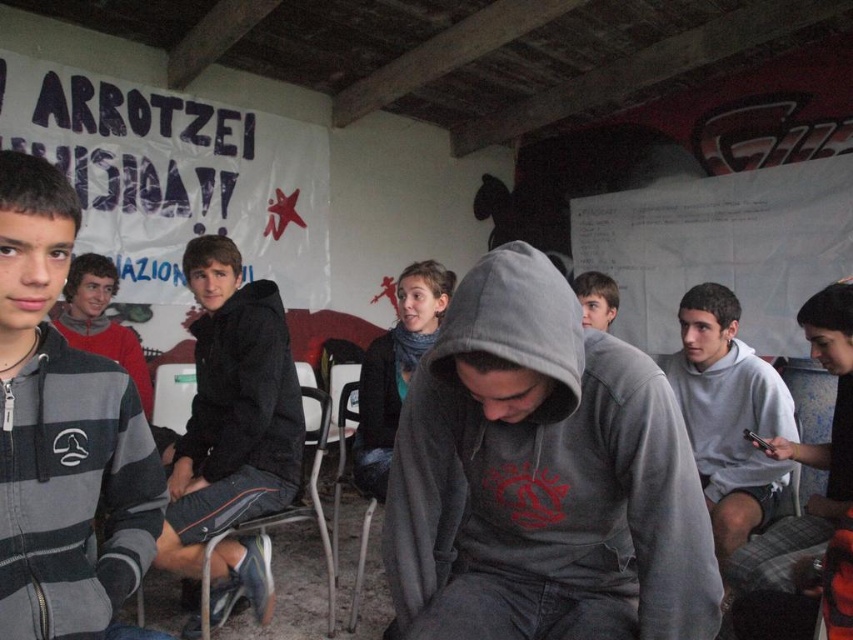
Question: Is striped cotton hoodie at left to the left of black matte sweatshirt at center from the viewer's perspective?

Choices:
 (A) yes
 (B) no

Answer: (B)

Question: Which object appears closest to the camera in this image?

Choices:
 (A) black matte jacket at center
 (B) gray matte hoodie at center
 (C) black matte sweatshirt at center

Answer: (B)

Question: Is gray matte hoodie at center positioned in front of black matte sweatshirt at center?

Choices:
 (A) no
 (B) yes

Answer: (B)

Question: Among these points, which one is nearest to the camera?

Choices:
 (A) (194, 400)
 (B) (601, 556)

Answer: (B)

Question: Observing the image, what is the correct spatial positioning of gray matte hoodie at center in reference to striped cotton hoodie at left?

Choices:
 (A) above
 (B) below

Answer: (B)

Question: Which point is farther from the camera taking this photo?

Choices:
 (A) click(x=248, y=385)
 (B) click(x=106, y=636)
 (C) click(x=610, y=365)
 (D) click(x=706, y=355)

Answer: (D)